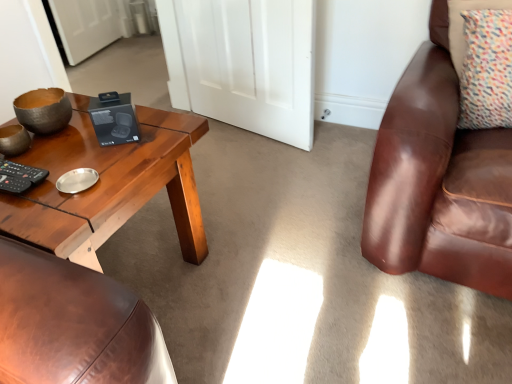
This screenshot has height=384, width=512. I want to click on free spot above woodenmaterial/texturecoffee table at left (from a real-world perspective), so click(73, 158).